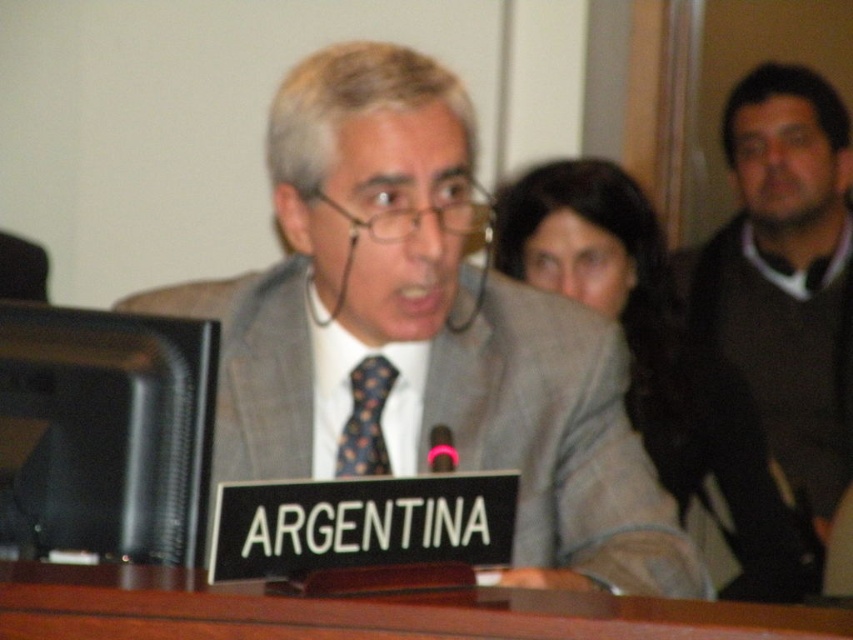
In the scene shown: You are attending a conference and need to move from the podium to the exit located at point (x=729, y=125). There is an obstacle at point (x=572, y=282). Can you safely navigate around the obstacle to reach the exit?

Point (x=729, y=125) is behind point (x=572, y=282), so the obstacle at point (x=572, y=282) is between you and the exit. You will need to navigate around the obstacle to reach the exit safely.